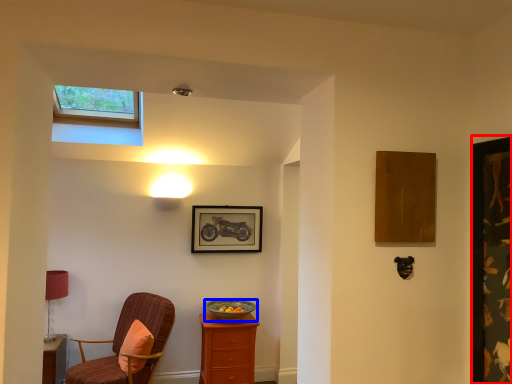
Question: Which object is closer to the camera taking this photo, picture frame (highlighted by a red box) or bowl (highlighted by a blue box)?

Choices:
 (A) picture frame
 (B) bowl

Answer: (A)